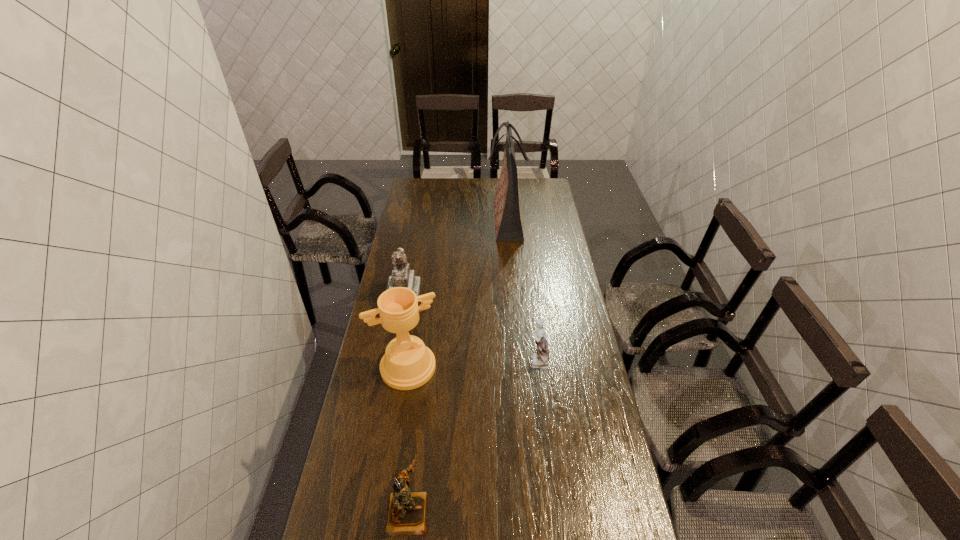
The height and width of the screenshot is (540, 960). In order to click on free space at the far right corner in this screenshot , I will do `click(529, 186)`.

Identify the location of vacant space in between the farthest object and the award. The width and height of the screenshot is (960, 540). (457, 294).

Find the location of a particular element. This screenshot has height=540, width=960. vacant point located between the nearest figurine and the second farthest figurine is located at coordinates (472, 437).

Where is `vacant point located between the rightmost figurine and the award`? This screenshot has width=960, height=540. vacant point located between the rightmost figurine and the award is located at coordinates (472, 364).

The height and width of the screenshot is (540, 960). Find the location of `empty space that is in between the award and the tallest object`. empty space that is in between the award and the tallest object is located at coordinates (457, 294).

Locate an element on the screen. This screenshot has height=540, width=960. free space between the nearest figurine and the farthest figurine is located at coordinates (406, 403).

You are a GUI agent. You are given a task and a screenshot of the screen. Output one action in this format:
    pyautogui.click(x=<x>, y=<y>)
    Task: Click on the free space between the award and the nearest figurine
    The width and height of the screenshot is (960, 540).
    Given the screenshot: What is the action you would take?
    pyautogui.click(x=408, y=440)

Where is `blank region between the shopping bag and the second tallest object`? The width and height of the screenshot is (960, 540). blank region between the shopping bag and the second tallest object is located at coordinates (457, 294).

This screenshot has width=960, height=540. I want to click on free spot between the nearest object and the shopping bag, so (x=457, y=366).

Locate an element on the screen. Image resolution: width=960 pixels, height=540 pixels. free point between the rightmost figurine and the award is located at coordinates (472, 364).